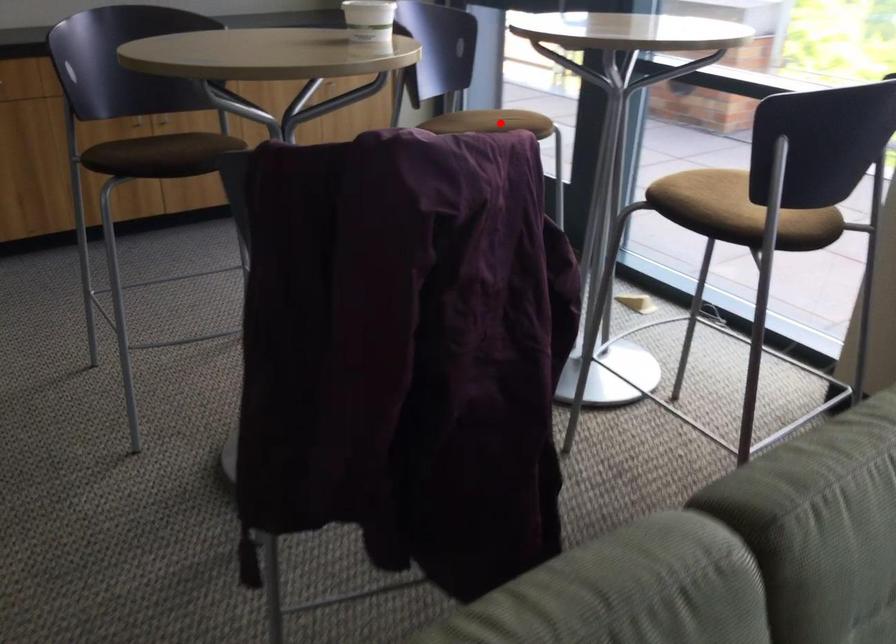
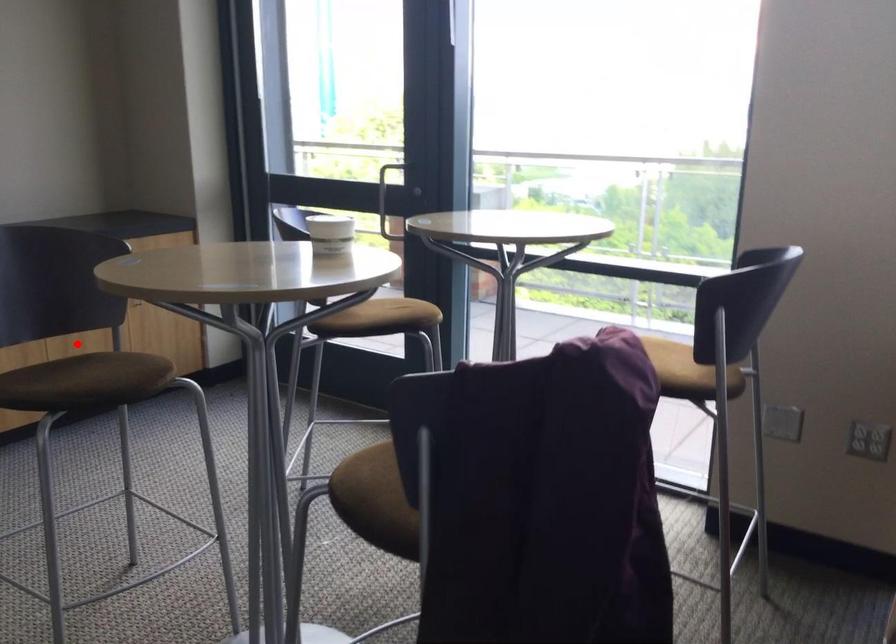
I am providing you with two images of the same scene from different viewpoints. A red point is marked on the first image and another point is marked on the second image. Are the points marked in image1 and image2 representing the same 3D position?

No